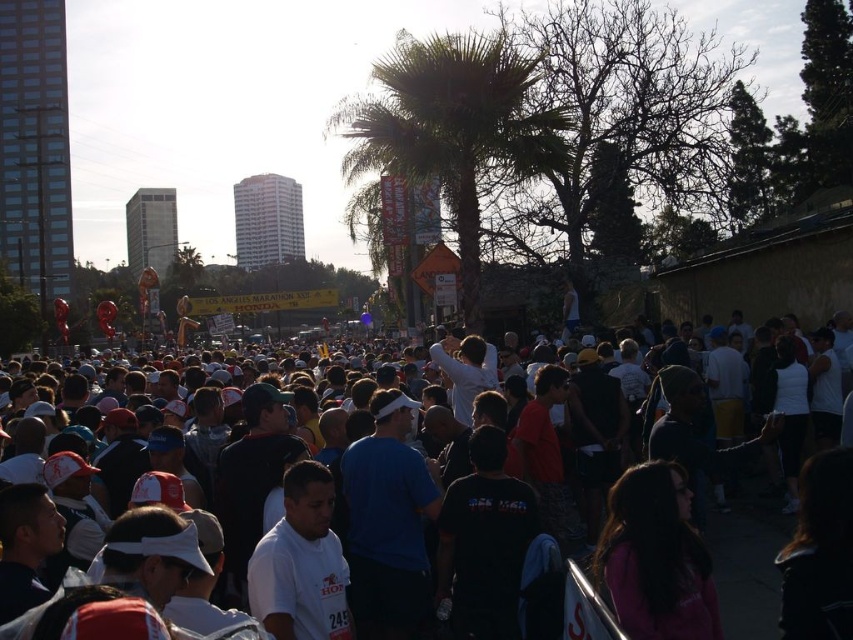
Consider the image. Is green leafy palm tree at center to the right of white cotton crowd at center from the viewer's perspective?

In fact, green leafy palm tree at center is to the left of white cotton crowd at center.

Based on the photo, which is more to the right, green leafy palm tree at center or white cotton crowd at center?

white cotton crowd at center is more to the right.

What do you see at coordinates (451, 129) in the screenshot? I see `green leafy palm tree at center` at bounding box center [451, 129].

Where is `green leafy palm tree at center`? green leafy palm tree at center is located at coordinates (451, 129).